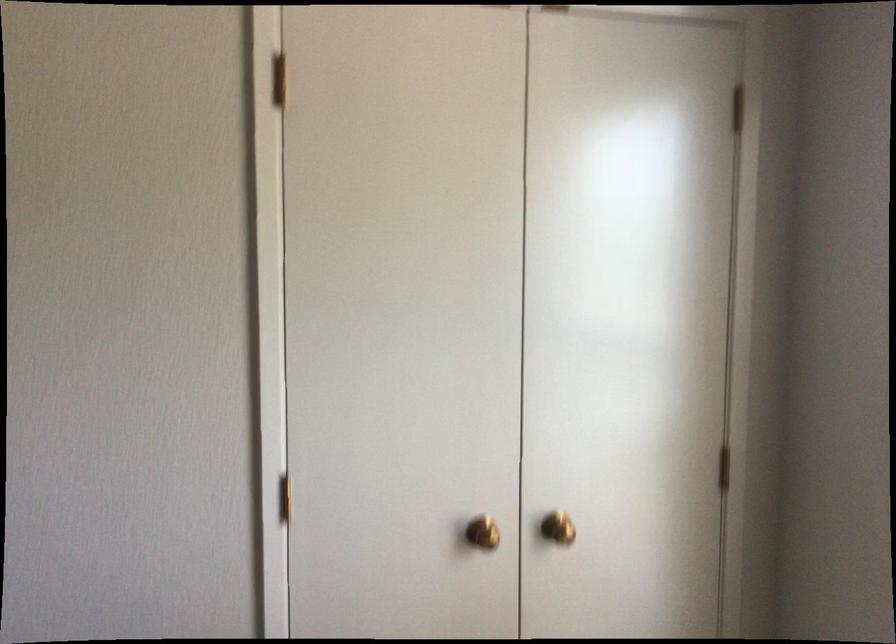
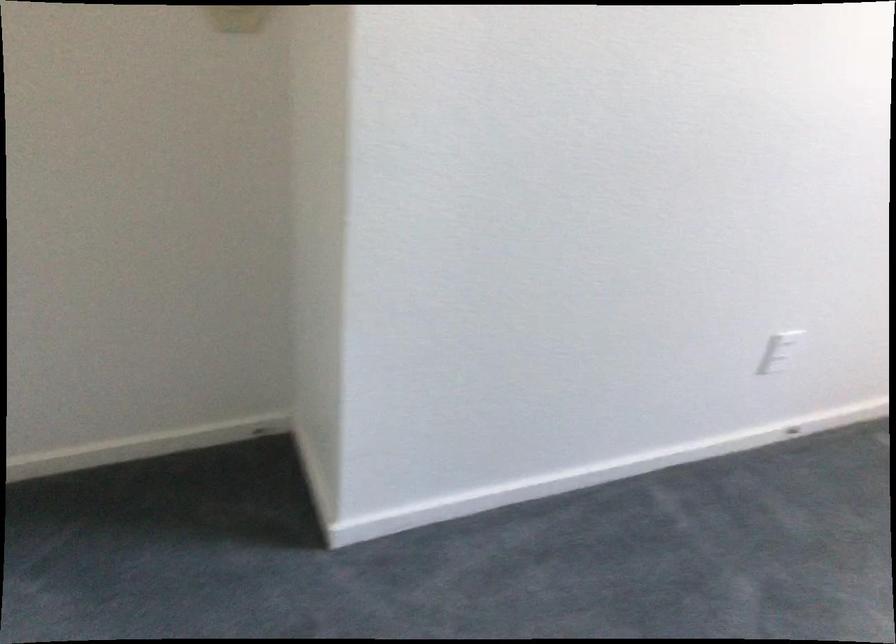
Question: The images are taken continuously from a first-person perspective. In which direction are you moving?

Choices:
 (A) Left
 (B) Right
 (C) Forward
 (D) Backward

Answer: (A)